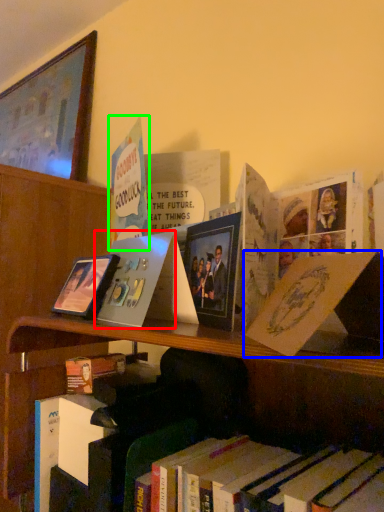
Question: Which object is the closest to the paperback book (highlighted by a red box)? Choose among these: paperback book (highlighted by a blue box) or book (highlighted by a green box).

Choices:
 (A) paperback book
 (B) book

Answer: (B)